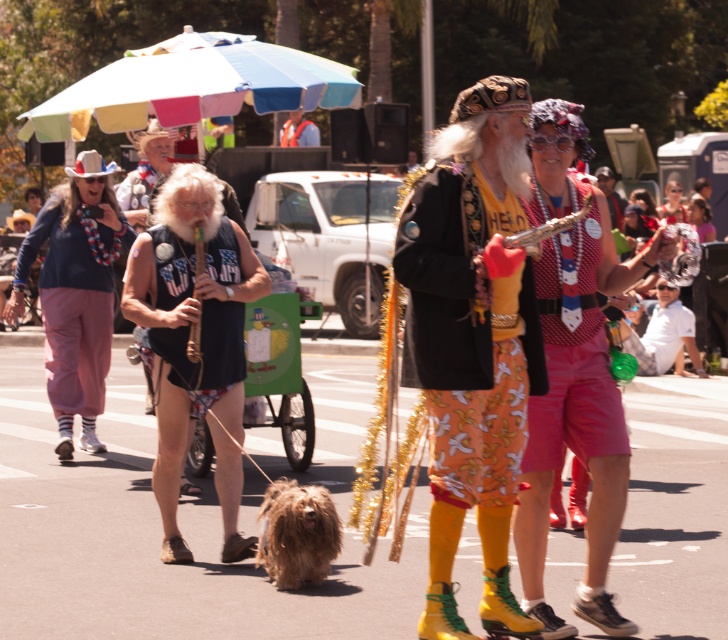
Does brown shaggy dog at center come in front of orange life vest at center?

Yes, it is in front of orange life vest at center.

Who is higher up, brown shaggy dog at center or orange life vest at center?

orange life vest at center is higher up.

Between point (293, 564) and point (317, 140), which one is positioned behind?

The point (317, 140) is behind.

Identify the location of brown shaggy dog at center. (296, 532).

Can you confirm if matte pink pants at left is positioned to the right of matte white shirt at center?

No, matte pink pants at left is not to the right of matte white shirt at center.

Which is behind, point (58, 253) or point (673, 346)?

The point (673, 346) is behind.

What are the coordinates of `matte pink pants at left` in the screenshot? It's located at coord(75,291).

Measure the distance from floral cotton shorts at center to orange life vest at center.

21.87 meters

Which of these two, floral cotton shorts at center or orange life vest at center, stands shorter?

Standing shorter between the two is orange life vest at center.

This screenshot has width=728, height=640. Find the location of `floral cotton shorts at center`. floral cotton shorts at center is located at coordinates (440, 288).